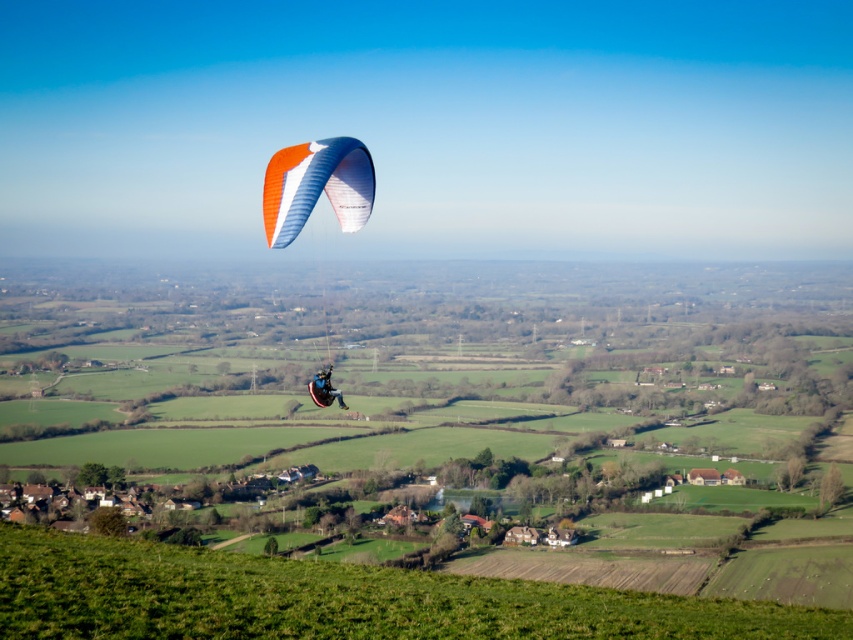
Is orange/white fabric parachute at center wider than matte blue paraglider at upper center?

Yes, orange/white fabric parachute at center is wider than matte blue paraglider at upper center.

Is point (346, 205) more distant than point (318, 385)?

That is True.

Does point (299, 152) come closer to viewer compared to point (309, 387)?

Yes.

You are a GUI agent. You are given a task and a screenshot of the screen. Output one action in this format:
    pyautogui.click(x=<x>, y=<y>)
    Task: Click on the orange/white fabric parachute at center
    The image size is (853, 640).
    Given the screenshot: What is the action you would take?
    pyautogui.click(x=316, y=186)

Is green grassy field at center thinner than matte blue paraglider at upper center?

Incorrect, green grassy field at center's width is not less than matte blue paraglider at upper center's.

Can you confirm if green grassy field at center is bigger than matte blue paraglider at upper center?

Correct, green grassy field at center is larger in size than matte blue paraglider at upper center.

Between point (412, 602) and point (318, 401), which one is positioned behind?

Positioned behind is point (318, 401).

Locate an element on the screen. green grassy field at center is located at coordinates (427, 381).

Who is positioned more to the left, green grassy field at center or orange/white fabric parachute at center?

From the viewer's perspective, orange/white fabric parachute at center appears more on the left side.

Locate an element on the screen. The image size is (853, 640). green grassy field at center is located at coordinates [427, 381].